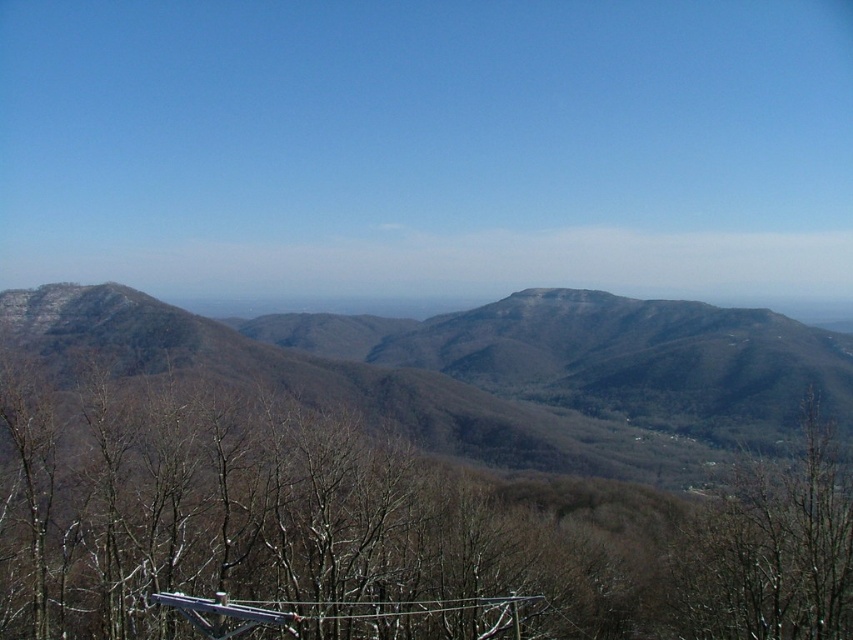
Between brown textured mountain range at center and brown leafless tree at lower right, which one appears on the right side from the viewer's perspective?

From the viewer's perspective, brown leafless tree at lower right appears more on the right side.

What do you see at coordinates (498, 378) in the screenshot? The width and height of the screenshot is (853, 640). I see `brown textured mountain range at center` at bounding box center [498, 378].

Is point (643, 458) closer to viewer compared to point (680, 611)?

No, (643, 458) is further to viewer.

Identify the location of brown textured mountain range at center. The height and width of the screenshot is (640, 853). (498, 378).